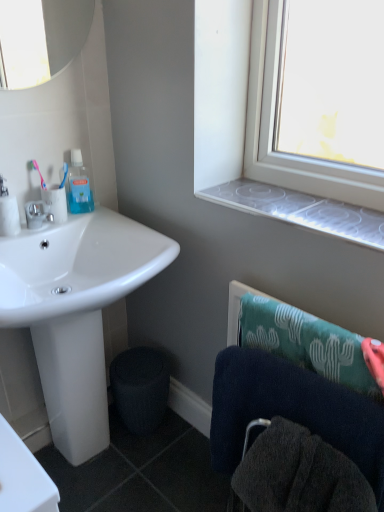
Describe the element at coordinates (9, 216) in the screenshot. I see `white matte toilet paper at left, acting as the 1th toilet paper starting from the left` at that location.

Where is `white glossy sink at lower left`? white glossy sink at lower left is located at coordinates (76, 311).

You are a GUI agent. You are given a task and a screenshot of the screen. Output one action in this format:
    pyautogui.click(x=<x>, y=<y>)
    Task: Click on the pink plastic toothbrush at upper left
    
    Given the screenshot: What is the action you would take?
    pyautogui.click(x=38, y=172)

What are the coordinates of `transparent plastic mouthwash at upper left` in the screenshot? It's located at (79, 186).

Identify the location of white glossy toilet paper at left, the first toilet paper when ordered from right to left. This screenshot has width=384, height=512. (55, 202).

I want to click on dark blue towel at lower right, so click(297, 473).

From the image's perspective, which is above, white glossy sink at lower left or matte silver faucet at left?

matte silver faucet at left is shown above in the image.

Could you tell me if white glossy sink at lower left is facing matte silver faucet at left?

No.

Is point (128, 227) closer to camera compared to point (37, 214)?

No, it is behind (37, 214).

Which of these two, transparent plastic mouthwash at upper left or transparent plastic window sill at upper right, stands shorter?

Standing shorter between the two is transparent plastic window sill at upper right.

Could you tell me if transparent plastic mouthwash at upper left is facing transparent plastic window sill at upper right?

No.

From a real-world perspective, who is located lower, white glossy sink at lower left or white glossy toilet paper at left, the first toilet paper when ordered from right to left?

white glossy sink at lower left is physically lower.

Considering the relative positions of white glossy sink at lower left and white glossy toilet paper at left, the second toilet paper positioned from the left, in the image provided, is white glossy sink at lower left in front of white glossy toilet paper at left, the second toilet paper positioned from the left,?

That is True.

Considering the sizes of objects white glossy sink at lower left and white glossy toilet paper at left, the second toilet paper positioned from the left, in the image provided, who is thinner, white glossy sink at lower left or white glossy toilet paper at left, the second toilet paper positioned from the left,?

Thinner between the two is white glossy toilet paper at left, the second toilet paper positioned from the left.

From a real-world perspective, is dark blue towel at lower right below transparent plastic window sill at upper right?

Yes, from a real-world perspective, dark blue towel at lower right is below transparent plastic window sill at upper right.

Is dark blue towel at lower right beside transparent plastic window sill at upper right?

No.

Does point (264, 483) come closer to viewer compared to point (228, 200)?

Yes, point (264, 483) is in front of point (228, 200).

Identify the location of window sill behind the dark blue towel at lower right. The image size is (384, 512). (301, 210).

In the scene shown: From the image's perspective, which object appears higher, pink plastic toothbrush at upper left or transparent plastic window sill at upper right?

pink plastic toothbrush at upper left.

Where is `window sill on the right of the pink plastic toothbrush at upper left`? The width and height of the screenshot is (384, 512). window sill on the right of the pink plastic toothbrush at upper left is located at coordinates (301, 210).

Is point (34, 167) closer to camera compared to point (308, 214)?

No, (34, 167) is further to viewer.

Identify the location of window sill that appears in front of the white glossy toilet paper at left, the second toilet paper positioned from the left. (301, 210).

Considering the sizes of objects white glossy toilet paper at left, the first toilet paper when ordered from right to left, and transparent plastic window sill at upper right in the image provided, who is shorter, white glossy toilet paper at left, the first toilet paper when ordered from right to left, or transparent plastic window sill at upper right?

transparent plastic window sill at upper right.

How far apart are white glossy toilet paper at left, the second toilet paper positioned from the left, and transparent plastic window sill at upper right?

white glossy toilet paper at left, the second toilet paper positioned from the left, and transparent plastic window sill at upper right are 28.11 inches apart.

Would you say white glossy toilet paper at left, the first toilet paper when ordered from right to left, is inside or outside transparent plastic window sill at upper right?

white glossy toilet paper at left, the first toilet paper when ordered from right to left, is spatially situated outside transparent plastic window sill at upper right.

Is matte silver faucet at left far from white matte toilet paper at left, acting as the 1th toilet paper starting from the left?

Actually, matte silver faucet at left and white matte toilet paper at left, acting as the 1th toilet paper starting from the left, are a little close together.

Is white matte toilet paper at left, acting as the 1th toilet paper starting from the left, at the back of matte silver faucet at left?

That's not correct — matte silver faucet at left is not looking away from white matte toilet paper at left, acting as the 1th toilet paper starting from the left.

Is matte silver faucet at left inside or outside of white matte toilet paper at left, acting as the 1th toilet paper starting from the left?

matte silver faucet at left is located beyond the bounds of white matte toilet paper at left, acting as the 1th toilet paper starting from the left.

From a real-world perspective, which is physically below, matte silver faucet at left or white matte toilet paper at left, the 2th toilet paper from the right?

matte silver faucet at left is physically lower.

Identify the location of tap behind the white glossy sink at lower left. This screenshot has height=512, width=384. point(38,214).

The image size is (384, 512). In order to click on window sill below the transparent plastic mouthwash at upper left (from the image's perspective) in this screenshot , I will do (x=301, y=210).

Based on their spatial positions, is pink plastic toothbrush at upper left or transparent plastic window sill at upper right closer to transparent plastic mouthwash at upper left?

The object closer to transparent plastic mouthwash at upper left is pink plastic toothbrush at upper left.

Considering their positions, is white glossy toilet paper at left, the second toilet paper positioned from the left, positioned closer to transparent plastic window sill at upper right than matte silver faucet at left?

white glossy toilet paper at left, the second toilet paper positioned from the left, is positioned closer to the anchor transparent plastic window sill at upper right.

From the picture: Based on their spatial positions, is transparent plastic mouthwash at upper left or white glossy toilet paper at left, the first toilet paper when ordered from right to left, closer to transparent plastic window sill at upper right?

transparent plastic mouthwash at upper left is closer to transparent plastic window sill at upper right.

Looking at the image, which one is located closer to dark blue towel at lower right, transparent plastic mouthwash at upper left or white glossy toilet paper at left, the second toilet paper positioned from the left?

white glossy toilet paper at left, the second toilet paper positioned from the left, lies closer to dark blue towel at lower right than the other object.

Which object lies further to the anchor point dark blue towel at lower right, transparent plastic mouthwash at upper left or matte silver faucet at left?

The object further to dark blue towel at lower right is transparent plastic mouthwash at upper left.

From the image, which object appears to be farther from dark blue towel at lower right, pink plastic toothbrush at upper left or transparent plastic mouthwash at upper left?

Based on the image, pink plastic toothbrush at upper left appears to be further to dark blue towel at lower right.

Looking at the image, which one is located closer to pink plastic toothbrush at upper left, matte silver faucet at left or dark blue towel at lower right?

Among the two, matte silver faucet at left is located nearer to pink plastic toothbrush at upper left.

When comparing their distances from dark blue towel at lower right, does white glossy toilet paper at left, the first toilet paper when ordered from right to left, or pink plastic toothbrush at upper left seem closer?

white glossy toilet paper at left, the first toilet paper when ordered from right to left.

Where is `tap between white matte toilet paper at left, acting as the 1th toilet paper starting from the left, and white glossy sink at lower left vertically`? tap between white matte toilet paper at left, acting as the 1th toilet paper starting from the left, and white glossy sink at lower left vertically is located at coordinates (38, 214).

Where is `toilet paper situated between pink plastic toothbrush at upper left and transparent plastic mouthwash at upper left from left to right`? The image size is (384, 512). toilet paper situated between pink plastic toothbrush at upper left and transparent plastic mouthwash at upper left from left to right is located at coordinates [55, 202].

The image size is (384, 512). What are the coordinates of `sink between transparent plastic mouthwash at upper left and transparent plastic window sill at upper right` in the screenshot? It's located at (76, 311).

Locate an element on the screen. The width and height of the screenshot is (384, 512). tap situated between pink plastic toothbrush at upper left and transparent plastic window sill at upper right from left to right is located at coordinates (38, 214).